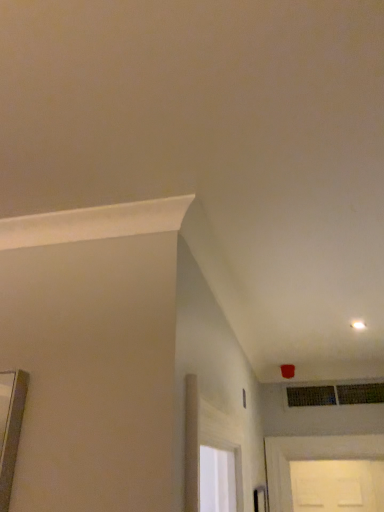
What do you see at coordinates (335, 395) in the screenshot? I see `matte black vent at upper right` at bounding box center [335, 395].

Where is `matte black vent at upper right`? This screenshot has width=384, height=512. matte black vent at upper right is located at coordinates (335, 395).

Measure the distance between matte black vent at upper right and camera.

matte black vent at upper right is 2.98 meters from camera.

What is the approximate width of matte black vent at upper right?

1.06 inches.

In order to face matte black vent at upper right, should I rotate leftwards or rightwards?

A 17.759 degree turn to the right will do.

Find the location of a particular element. This screenshot has width=384, height=512. matte black vent at upper right is located at coordinates (335, 395).